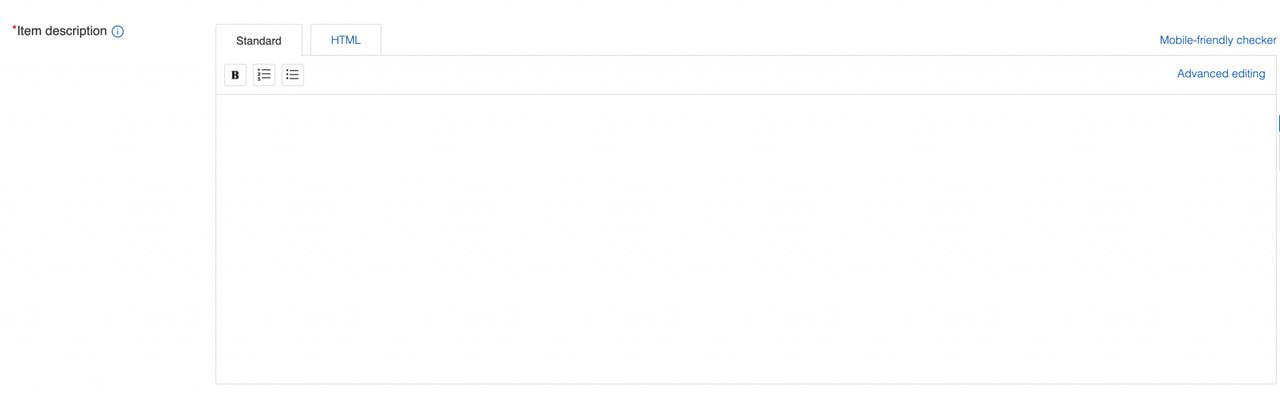
This screenshot has height=394, width=1280. In order to click on box in this screenshot , I will do `click(379, 301)`.